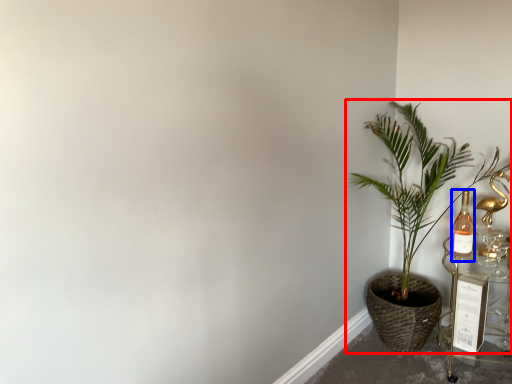
Question: Which object appears closest to the camera in this image, houseplant (highlighted by a red box) or bottle (highlighted by a blue box)?

Choices:
 (A) houseplant
 (B) bottle

Answer: (A)